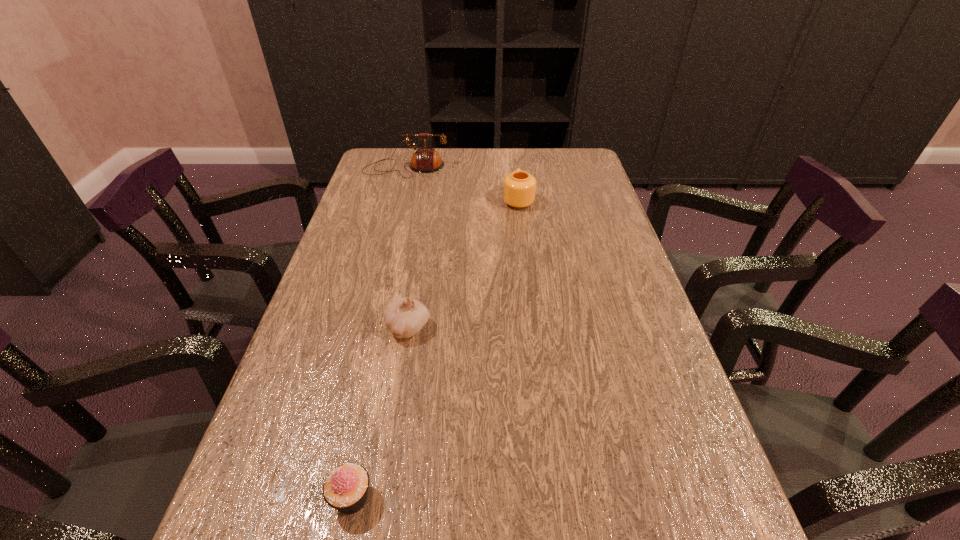
Identify which object is the second closest to the telephone. Please provide its 2D coordinates. Your answer should be formatted as a tuple, i.e. [(x, y)], where the tuple contains the x and y coordinates of a point satisfying the conditions above.

[(405, 317)]

The height and width of the screenshot is (540, 960). I want to click on object that is the third closest to the rightmost object, so click(346, 487).

The width and height of the screenshot is (960, 540). Find the location of `free location that satisfies the following two spatial constraints: 1. on the rotary dial of the third farthest object; 2. on the right side of the telephone`. free location that satisfies the following two spatial constraints: 1. on the rotary dial of the third farthest object; 2. on the right side of the telephone is located at coordinates (x=365, y=328).

Locate an element on the screen. free space that satisfies the following two spatial constraints: 1. on the rotary dial of the telephone; 2. on the right side of the garlic is located at coordinates (365, 328).

You are a GUI agent. You are given a task and a screenshot of the screen. Output one action in this format:
    pyautogui.click(x=<x>, y=<y>)
    Task: Click on the vacant space that satisfies the following two spatial constraints: 1. on the rotary dial of the farthest object; 2. on the right side of the nearest object
    This screenshot has width=960, height=540.
    Given the screenshot: What is the action you would take?
    pyautogui.click(x=322, y=498)